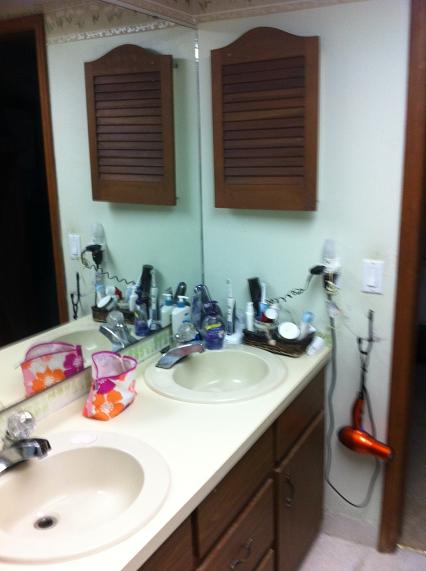
Identify the location of light tan counter top. (196, 439).